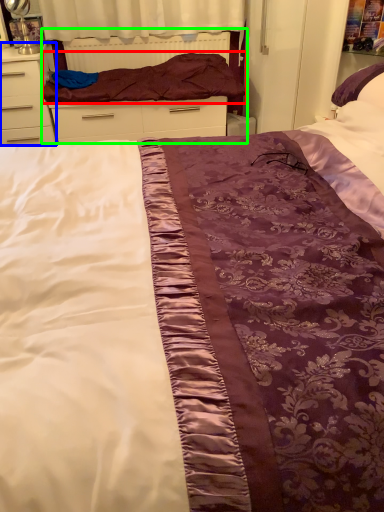
Question: Based on their relative distances, which object is nearer to blanket (highlighted by a red box)? Choose from chest of drawers (highlighted by a blue box) and bed frame (highlighted by a green box).

Choices:
 (A) chest of drawers
 (B) bed frame

Answer: (B)